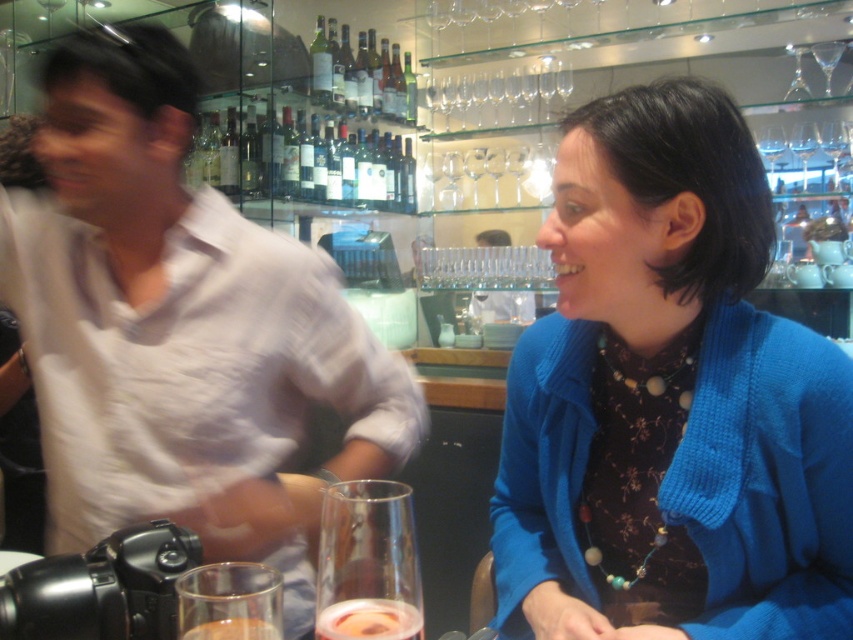
You are a customer at the wine bar and want to grab a drink. You see the translucent glass wine bottle at center and the clear glass at lower left. Which one is closer to the left side of the image?

The translucent glass wine bottle at center is to the left of clear glass at lower left, so the translucent glass wine bottle at center is closer to the left side of the image.

You are a delivery person who needs to place a new wine bottle in the wine bar. The new bottle is 1.5 feet wide. The existing translucent glass wine bottle at center is 8.07 feet away from the delivery entrance. Can you fit the new bottle next to the existing one without moving it?

The existing translucent glass wine bottle at center is 8.07 feet away from the delivery entrance. Since the new bottle is only 1.5 feet wide, it can be placed next to the existing one as long as there is enough space between them. However, the distance provided refers to their separation, so if they need to be 8.07 feet apart, placing them closer might not comply. Clarification on spacing requirements is needed.